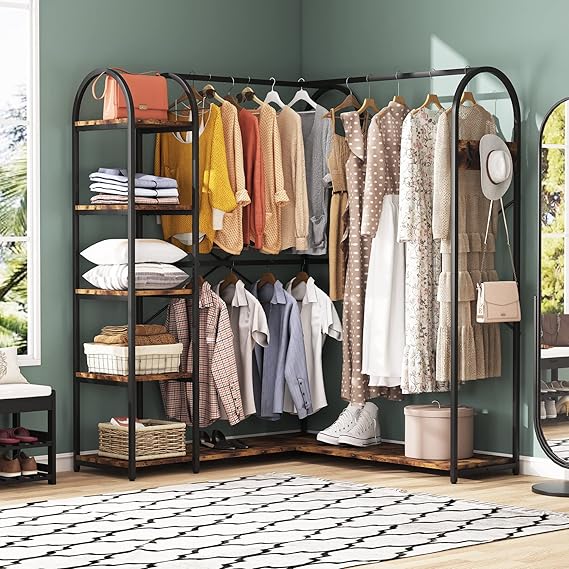
The image size is (569, 569). Identify the location of front view of shoes on shelf. (218, 447), (239, 444), (328, 432), (350, 439).